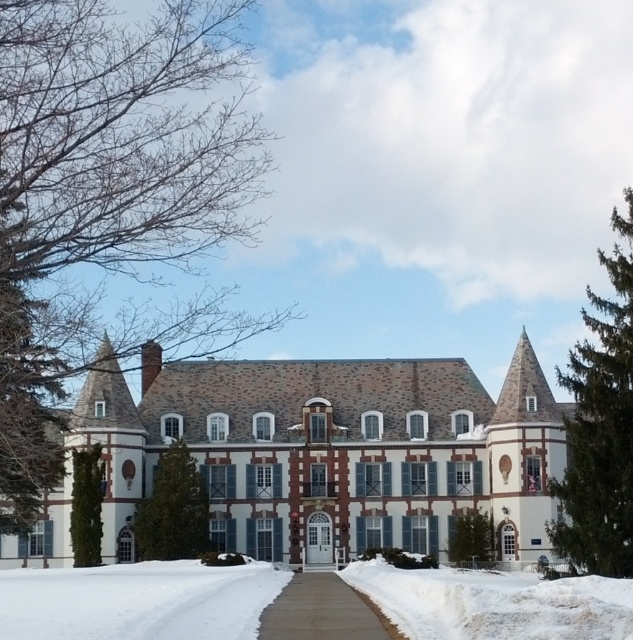
Is gray concrete sidewalk at center thinner than green leafy tree at center?

In fact, gray concrete sidewalk at center might be wider than green leafy tree at center.

Does point (361, 627) come closer to viewer compared to point (191, 532)?

Yes, it is.

Identify the location of gray concrete sidewalk at center. (323, 611).

Who is positioned more to the right, gray concrete sidewalk at center or green textured tree at lower center?

green textured tree at lower center

Is gray concrete sidewalk at center to the left of green textured tree at lower center from the viewer's perspective?

Correct, you'll find gray concrete sidewalk at center to the left of green textured tree at lower center.

I want to click on gray concrete sidewalk at center, so click(x=323, y=611).

Find the location of a particular element. This screenshot has width=633, height=640. gray concrete sidewalk at center is located at coordinates (323, 611).

Who is taller, white stone mansion at center or green textured tree at lower center?

With more height is white stone mansion at center.

In the scene shown: Which is more to the right, white stone mansion at center or green textured tree at lower center?

green textured tree at lower center is more to the right.

Between point (360, 419) and point (461, 554), which one is positioned in front?

Point (461, 554)

At what (x,y) coordinates should I click in order to perform the action: click on white stone mansion at center. Please return your answer as a coordinate pair (x, y). The height and width of the screenshot is (640, 633). Looking at the image, I should click on (318, 454).